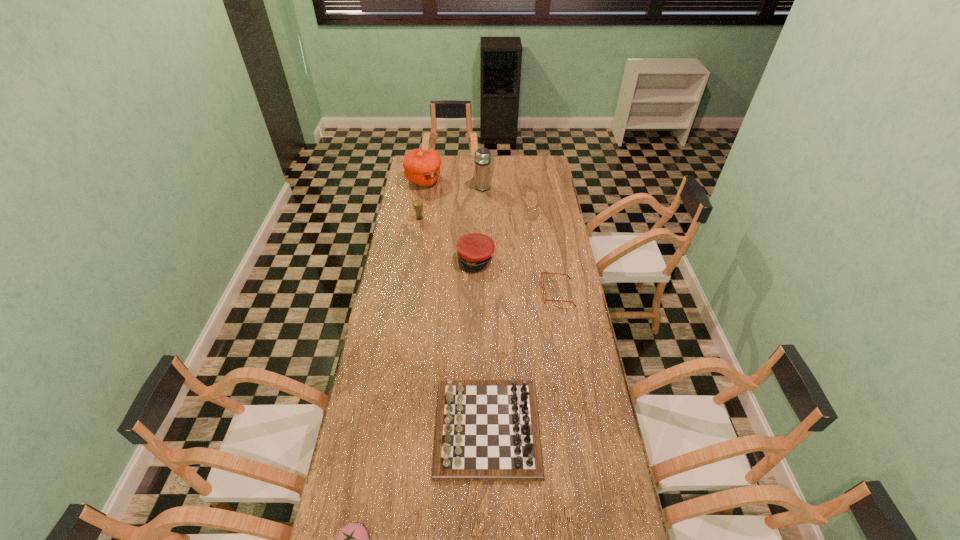
Where is `free area in between the pumpkin and the cap`? The height and width of the screenshot is (540, 960). free area in between the pumpkin and the cap is located at coordinates (449, 220).

You are a GUI agent. You are given a task and a screenshot of the screen. Output one action in this format:
    pyautogui.click(x=<x>, y=<y>)
    Task: Click on the free spot between the second tallest object and the second nearest object
    
    Given the screenshot: What is the action you would take?
    pyautogui.click(x=456, y=304)

Locate an element on the screen. The height and width of the screenshot is (540, 960). unoccupied area between the chessboard and the spectacles is located at coordinates (522, 360).

Find the location of a particular element. The image size is (960, 540). free space between the spectacles and the chessboard is located at coordinates 522,360.

Identify which object is the second closest to the tallest object. Please provide its 2D coordinates. Your answer should be formatted as a tuple, i.e. [(x, y)], where the tuple contains the x and y coordinates of a point satisfying the conditions above.

[(417, 204)]

Locate an element on the screen. Image resolution: width=960 pixels, height=540 pixels. the third closest object to the pumpkin is located at coordinates (474, 250).